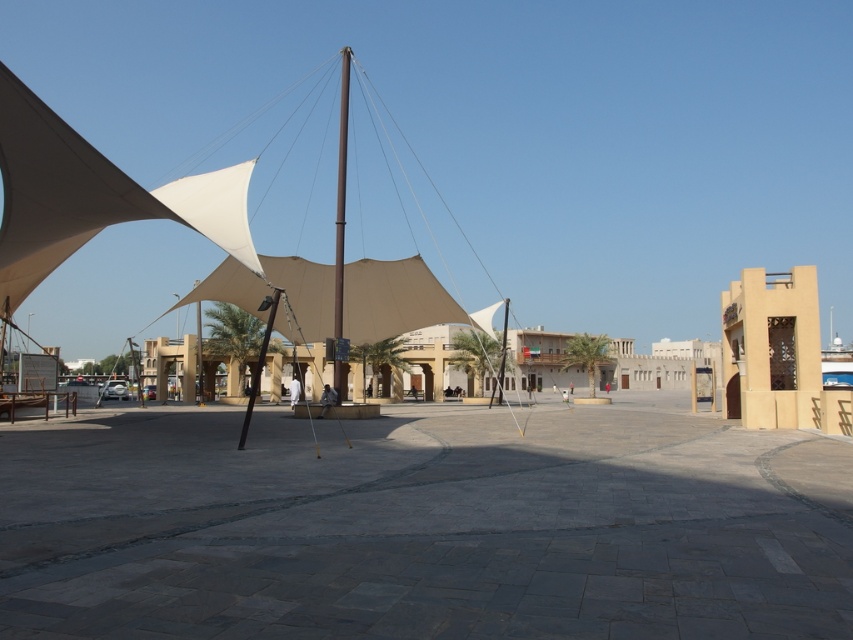
Question: Which point is farther to the camera?

Choices:
 (A) (256, 580)
 (B) (241, 435)
 (C) (347, 332)

Answer: (C)

Question: Which object is closer to the camera taking this photo?

Choices:
 (A) black metal pole at center
 (B) smooth stone pavement at center
 (C) smooth gray pole at center

Answer: (B)

Question: Is smooth stone pavement at center positioned at the back of black metal pole at center?

Choices:
 (A) yes
 (B) no

Answer: (B)

Question: Which object is farther from the camera taking this photo?

Choices:
 (A) smooth stone pavement at center
 (B) smooth gray pole at center

Answer: (B)

Question: Does beige fabric canopy at center appear under black metal pole at center?

Choices:
 (A) no
 (B) yes

Answer: (A)

Question: Is smooth gray pole at center wider than black metal pole at center?

Choices:
 (A) yes
 (B) no

Answer: (B)